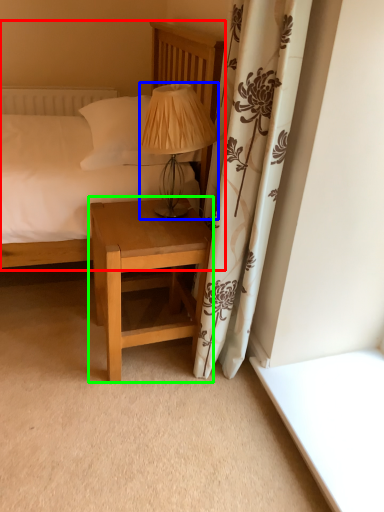
Question: Which object is the farthest from bed (highlighted by a red box)? Choose among these: table lamp (highlighted by a blue box) or nightstand (highlighted by a green box).

Choices:
 (A) table lamp
 (B) nightstand

Answer: (B)